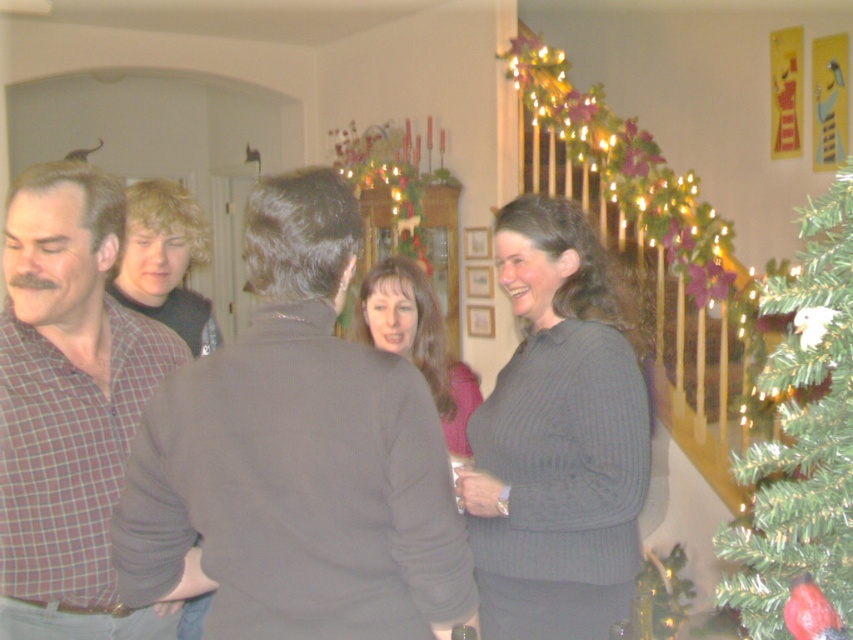
You are at a party and want to take a photo of the dark gray sweater at center and the green textured christmas tree at right. Which object will appear closer to the camera in the photo?

The dark gray sweater at center will appear closer to the camera because it is in front of the green textured christmas tree at right.

You are a photographer trying to capture a group photo of the dark gray sweater at center and the plaid shirt at left. The camera you are using has a minimum focusing distance of 45 centimeters. Will you be able to take a clear photo of both subjects without moving either of them?

The dark gray sweater at center and plaid shirt at left are 45.20 centimeters apart. Since the minimum focusing distance is 45 centimeters, the camera can focus on both subjects as the distance between them is just over the required minimum. Therefore, a clear photo is possible without moving them.